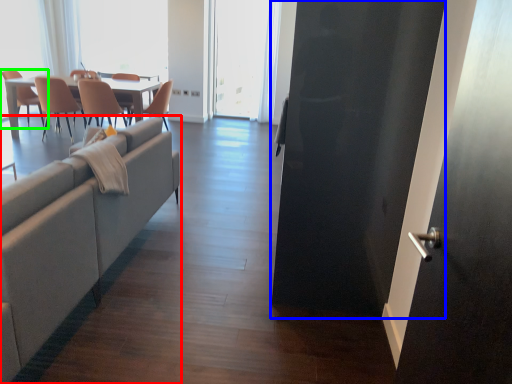
Question: Estimate the real-world distances between objects in this image. Which object is farther from studio couch (highlighted by a red box), screen door (highlighted by a blue box) or chair (highlighted by a green box)?

Choices:
 (A) screen door
 (B) chair

Answer: (B)